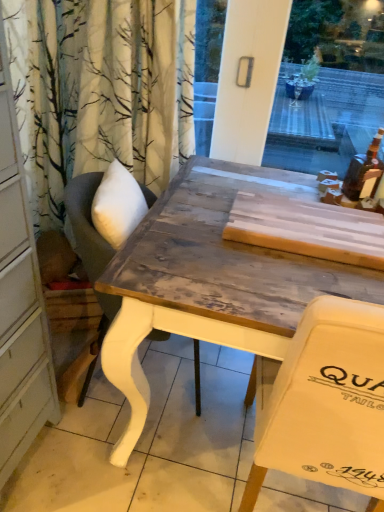
I want to click on free space below wooden chair at center (from a real-world perspective), so coord(161,384).